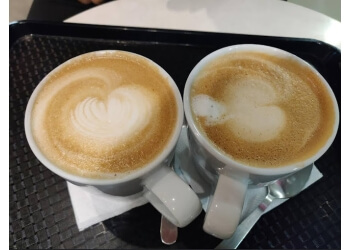
Find the location of a particular element. This screenshot has width=350, height=250. mugs is located at coordinates (116, 190), (210, 159).